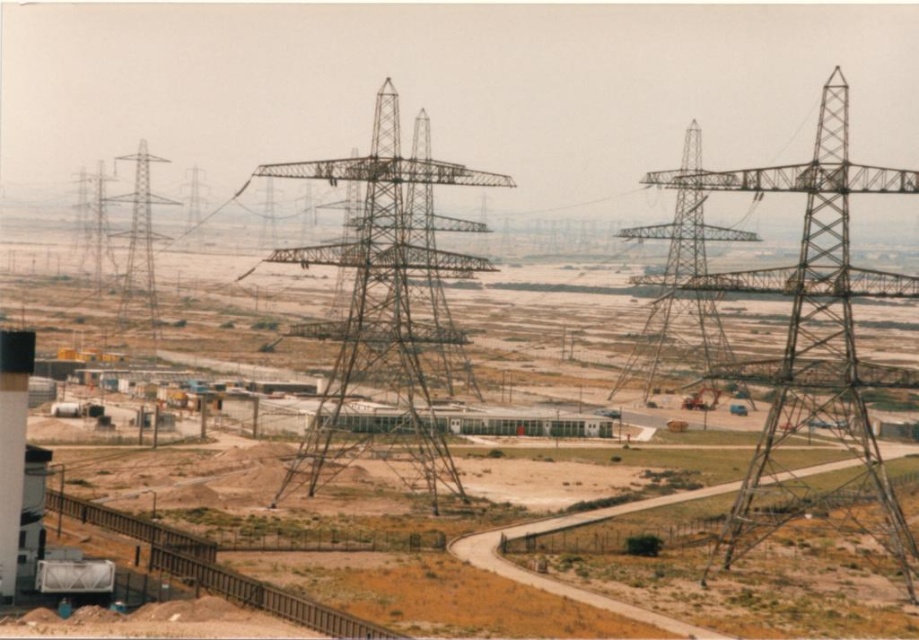
You are a train engineer approaching the scene from the lower left. You see the green metallic tower at center and the metallic train track at lower left. Which object is closer to your current position?

The metallic train track at lower left is closer to your current position because it is positioned below the green metallic tower at center, indicating it is nearer to the engineer.

You are a maintenance worker needing to inspect both the metallic structure at center and the green metallic tower at center. Based on their positions, which one should you inspect first to follow the standard inspection route that starts from the nearest object?

You should inspect the metallic structure at center first because it is closer to the viewer than the green metallic tower at center, following the standard inspection route starting from the nearest object.